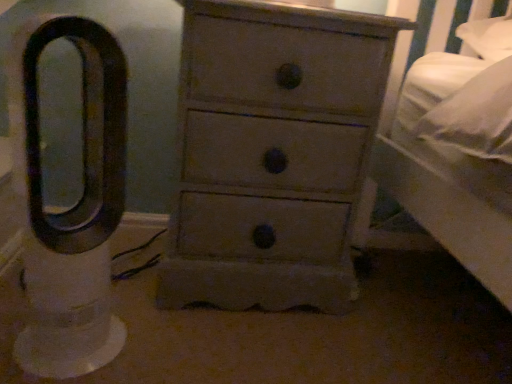
In order to click on free spot to the right of white plastic fan at left in this screenshot , I will do `click(172, 347)`.